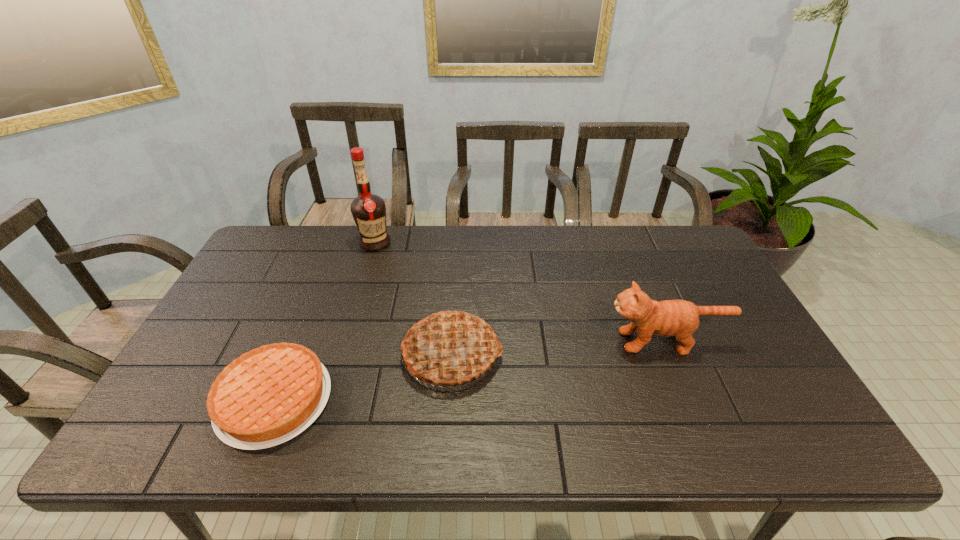
The image size is (960, 540). I want to click on unoccupied area between the tallest object and the rightmost object, so click(x=520, y=292).

At what (x,y) coordinates should I click in order to perform the action: click on vacant space in between the shortest object and the right pie. Please return your answer as a coordinate pair (x, y). Image resolution: width=960 pixels, height=540 pixels. Looking at the image, I should click on (363, 377).

The width and height of the screenshot is (960, 540). Identify the location of vacant area that lies between the second object from right to left and the shortest object. (363, 377).

Find the location of a particular element. vacant area between the farthest object and the rightmost object is located at coordinates (520, 292).

Locate which object ranks second in proximity to the cat. Please provide its 2D coordinates. Your answer should be formatted as a tuple, i.e. [(x, y)], where the tuple contains the x and y coordinates of a point satisfying the conditions above.

[(267, 396)]

What are the coordinates of `object that is the third nearest to the tallest object` in the screenshot? It's located at (679, 318).

Find the location of a particular element. This screenshot has width=960, height=540. blank area in the image that satisfies the following two spatial constraints: 1. on the front and back of the tallest object; 2. on the right side of the third object from left to right is located at coordinates (342, 355).

Where is `free space in the image that satisfies the following two spatial constraints: 1. on the front and back of the taller pie; 2. on the left side of the farthest object`? free space in the image that satisfies the following two spatial constraints: 1. on the front and back of the taller pie; 2. on the left side of the farthest object is located at coordinates (342, 355).

At what (x,y) coordinates should I click in order to perform the action: click on vacant space that satisfies the following two spatial constraints: 1. on the front and back of the farthest object; 2. on the right side of the taller pie. Please return your answer as a coordinate pair (x, y). This screenshot has height=540, width=960. Looking at the image, I should click on (342, 355).

The height and width of the screenshot is (540, 960). In order to click on vacant region that satisfies the following two spatial constraints: 1. on the back side of the second object from right to left; 2. on the left side of the shorter pie in this screenshot , I will do `click(293, 355)`.